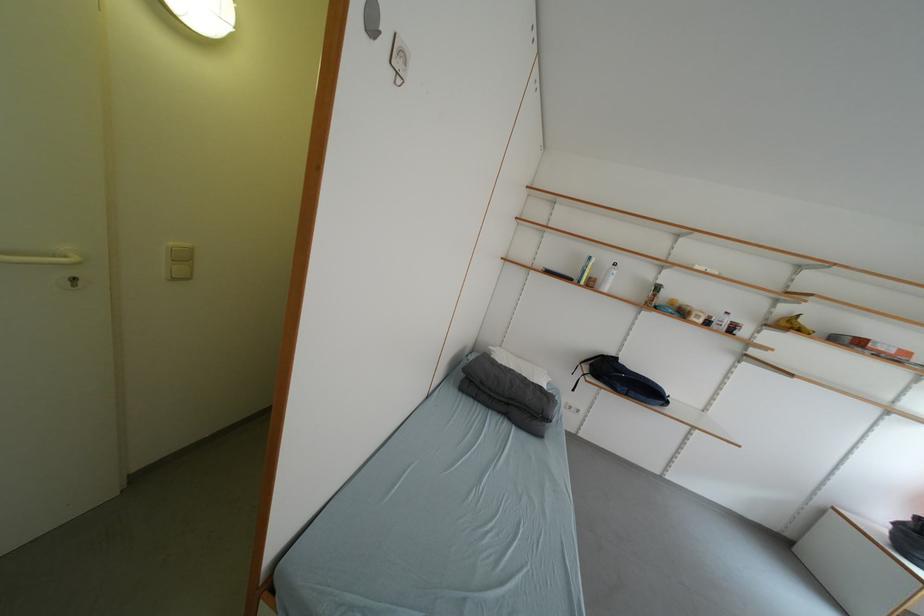
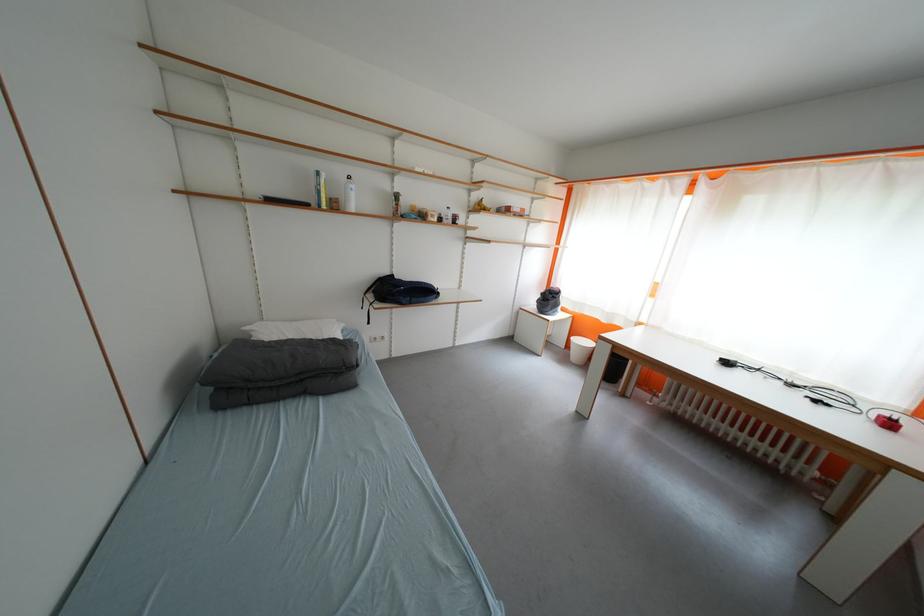
In the second image, find the point that corresponds to pixel 600 286 in the first image.

(344, 209)